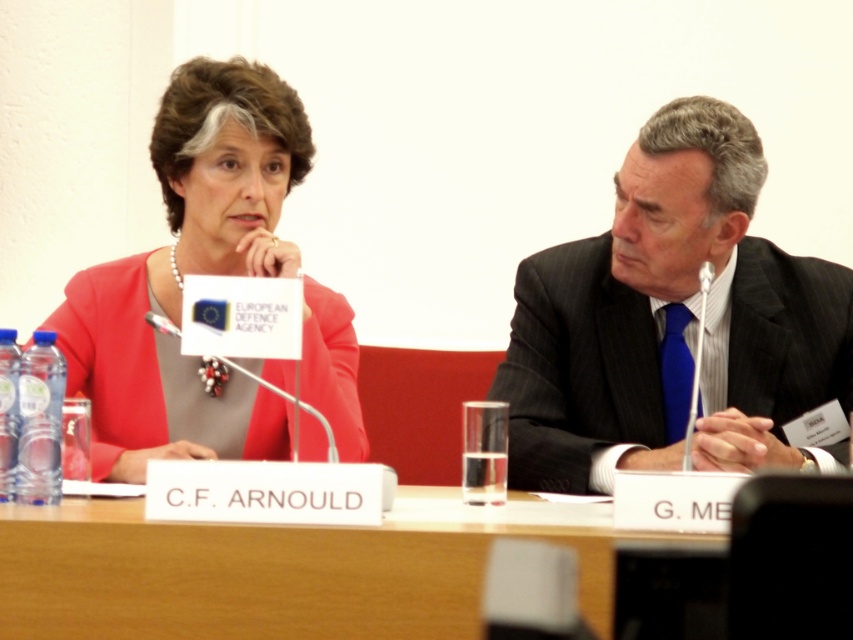
Question: Among these points, which one is farthest from the camera?

Choices:
 (A) (103, 515)
 (B) (321, 346)
 (C) (683, 138)

Answer: (B)

Question: Where is brown wood table at center located in relation to matte pink blazer at center in the image?

Choices:
 (A) left
 (B) right

Answer: (B)

Question: Which point appears closest to the camera in this image?

Choices:
 (A) (726, 445)
 (B) (148, 356)
 (C) (15, 582)

Answer: (C)

Question: Is brown wood table at center above matte pink blazer at center?

Choices:
 (A) no
 (B) yes

Answer: (A)

Question: Is brown wood table at center below matte pink blazer at center?

Choices:
 (A) yes
 (B) no

Answer: (A)

Question: Which is farther from the dark gray pinstripe suit at right?

Choices:
 (A) matte pink blazer at center
 (B) brown wood table at center

Answer: (A)